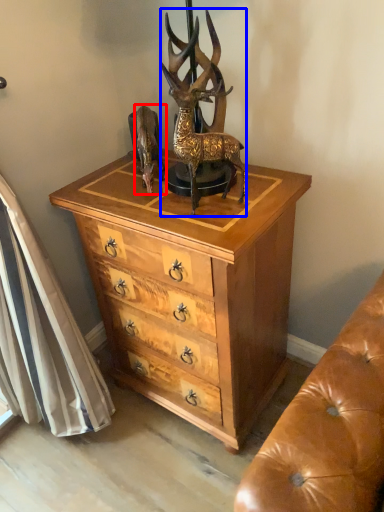
Question: Which object is further to the camera taking this photo, animal (highlighted by a red box) or deer (highlighted by a blue box)?

Choices:
 (A) animal
 (B) deer

Answer: (A)